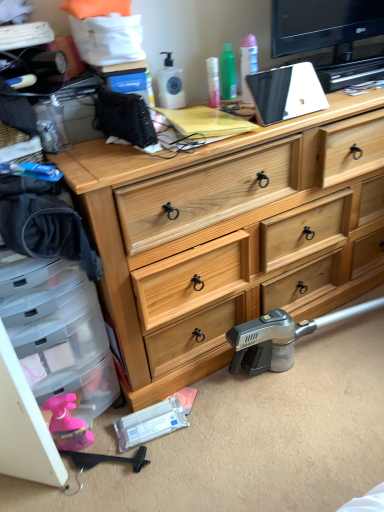
This screenshot has width=384, height=512. Find the location of `vacant region to the right of black plastic hammer at lower left`. vacant region to the right of black plastic hammer at lower left is located at coordinates (178, 462).